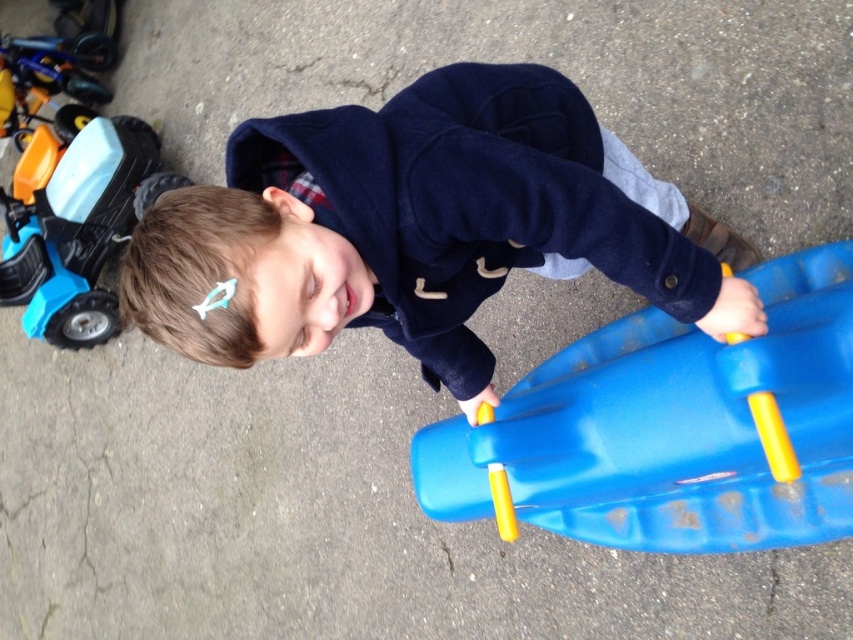
Consider the image. Does matte blue jacket at center appear under blue plastic sled at center?

Incorrect, matte blue jacket at center is not positioned below blue plastic sled at center.

Does matte blue jacket at center come behind blue plastic sled at center?

Yes, it is behind blue plastic sled at center.

What do you see at coordinates (419, 227) in the screenshot? This screenshot has width=853, height=640. I see `matte blue jacket at center` at bounding box center [419, 227].

Where is `matte blue jacket at center`? matte blue jacket at center is located at coordinates (419, 227).

Identify the location of blue plastic sled at center. (671, 428).

Is blue plastic sled at center further to camera compared to blue plastic toy car at left?

No, blue plastic sled at center is in front of blue plastic toy car at left.

Does point (556, 513) come closer to viewer compared to point (48, 269)?

Yes, it is in front of point (48, 269).

The width and height of the screenshot is (853, 640). What are the coordinates of `blue plastic sled at center` in the screenshot? It's located at (671, 428).

Who is taller, matte blue jacket at center or blue plastic toy car at left?

Standing taller between the two is blue plastic toy car at left.

Is matte blue jacket at center to the right of blue plastic toy car at left from the viewer's perspective?

Correct, you'll find matte blue jacket at center to the right of blue plastic toy car at left.

Locate an element on the screen. Image resolution: width=853 pixels, height=640 pixels. matte blue jacket at center is located at coordinates (419, 227).

Locate an element on the screen. matte blue jacket at center is located at coordinates (419, 227).